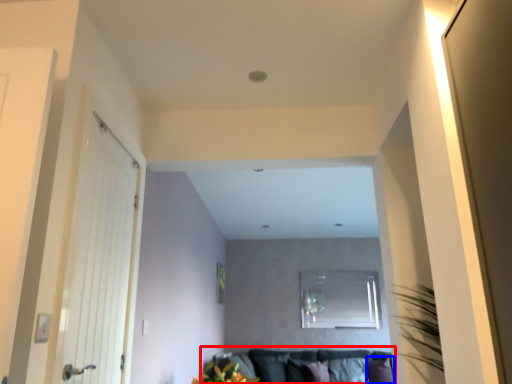
Question: Which object appears closest to the camera in this image, couch (highlighted by a red box) or pillow (highlighted by a blue box)?

Choices:
 (A) couch
 (B) pillow

Answer: (A)